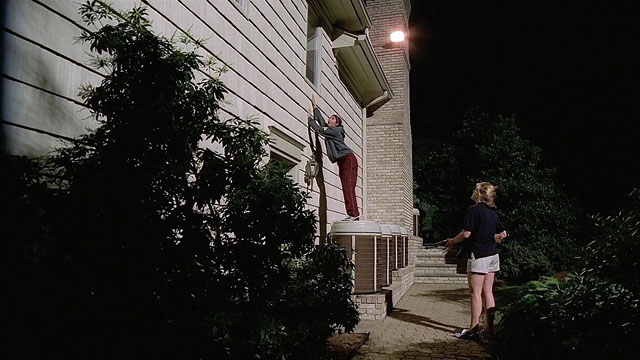
Find the location of a particular element. light is located at coordinates (400, 37).